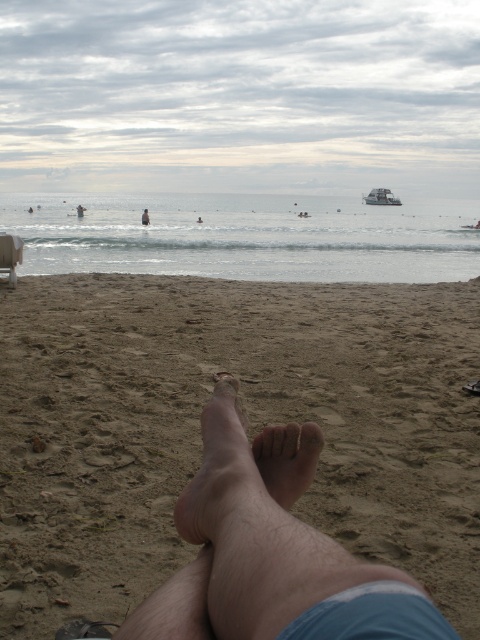
Question: Which of the following is the closest to the observer?

Choices:
 (A) pale skin foot at lower center
 (B) skinny person at lower center
 (C) dry skin at center

Answer: (A)

Question: Can you confirm if dry skin at center is positioned above pink matte toe at center?

Choices:
 (A) no
 (B) yes

Answer: (A)

Question: Is clear blue water at upper center positioned behind brown rough toe at center?

Choices:
 (A) yes
 (B) no

Answer: (A)

Question: Can you confirm if brown sandy beach at lower center is positioned to the right of pink matte toe at center?

Choices:
 (A) yes
 (B) no

Answer: (A)

Question: Among these objects, which one is nearest to the camera?

Choices:
 (A) skinny person at lower center
 (B) brown rough toe at center

Answer: (B)

Question: Which object is closer to the camera taking this photo?

Choices:
 (A) brown rough toe at center
 (B) pink matte toe at center
 (C) white plastic chair at lower left
 (D) dry skin at center

Answer: (D)